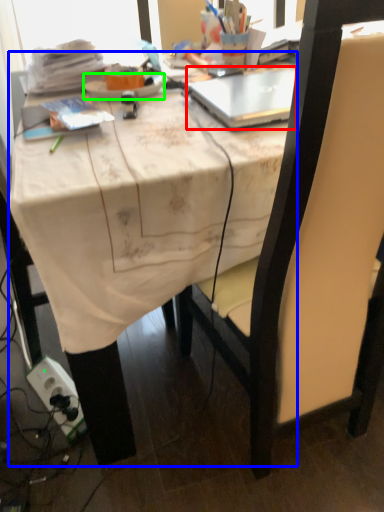
Question: Which object is the closest to the laptop (highlighted by a red box)? Choose among these: desk (highlighted by a blue box) or plate (highlighted by a green box).

Choices:
 (A) desk
 (B) plate

Answer: (B)